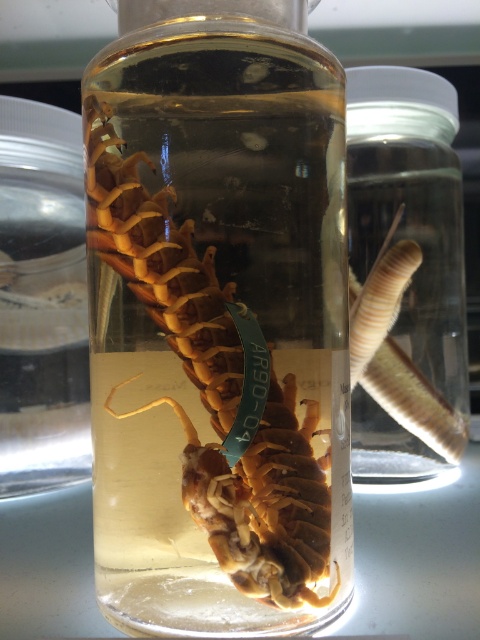
Between brown matte centipede at center and translucent glass worm at right, which one has less height?

Standing shorter between the two is brown matte centipede at center.

Which is behind, point (240, 481) or point (367, 374)?

Positioned behind is point (367, 374).

You are a GUI agent. You are given a task and a screenshot of the screen. Output one action in this format:
    pyautogui.click(x=<x>, y=<y>)
    Task: Click on the brown matte centipede at center
    The height and width of the screenshot is (640, 480).
    Given the screenshot: What is the action you would take?
    pyautogui.click(x=204, y=394)